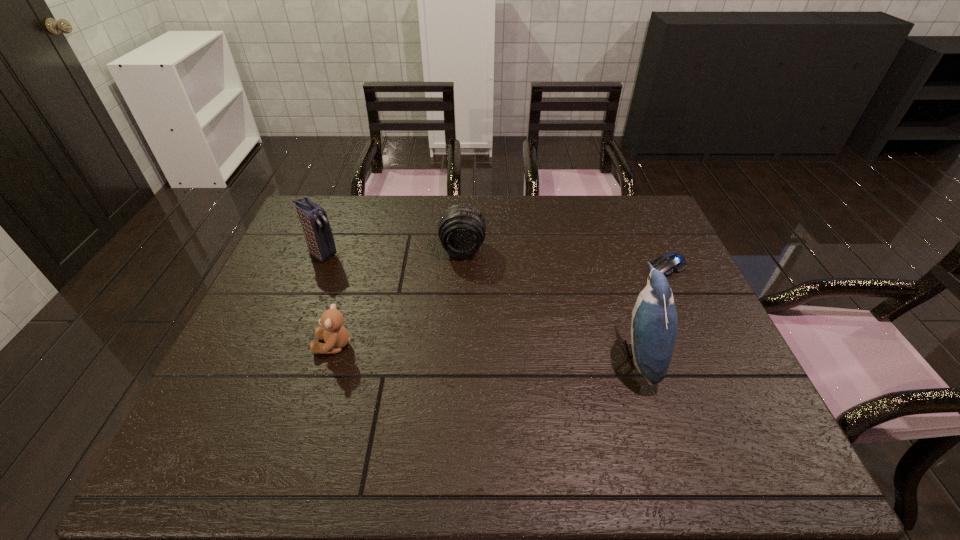
Identify the location of free space at the right edge. (734, 374).

Where is `vacant space at the far right corner of the desktop`? The width and height of the screenshot is (960, 540). vacant space at the far right corner of the desktop is located at coordinates (643, 207).

Where is `empty location between the third tallest object and the shortest object`? This screenshot has height=540, width=960. empty location between the third tallest object and the shortest object is located at coordinates tap(565, 258).

Find the location of a particular element. vacant region between the leftmost object and the rightmost object is located at coordinates (495, 260).

At what (x,y) coordinates should I click in order to perform the action: click on vacant space that is in between the tallest object and the telephoto lens. Please return your answer as a coordinate pair (x, y). This screenshot has height=540, width=960. Looking at the image, I should click on (550, 303).

In order to click on blank region between the fourth tallest object and the leftmost object in this screenshot , I will do `click(328, 300)`.

Locate an element on the screen. empty location between the computer mouse and the telephoto lens is located at coordinates (565, 258).

Identify the location of vacant space in between the teddy bear and the third object from right to left. (398, 298).

I want to click on free space between the second shortest object and the second object from right to left, so click(x=486, y=350).

Where is `free space between the teddy bear and the leftmost object`? free space between the teddy bear and the leftmost object is located at coordinates (328, 300).